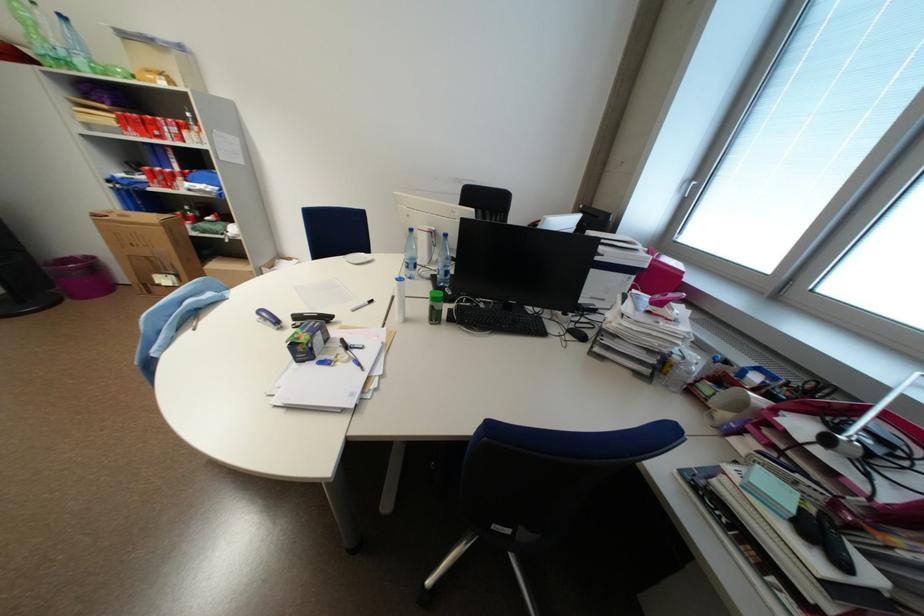
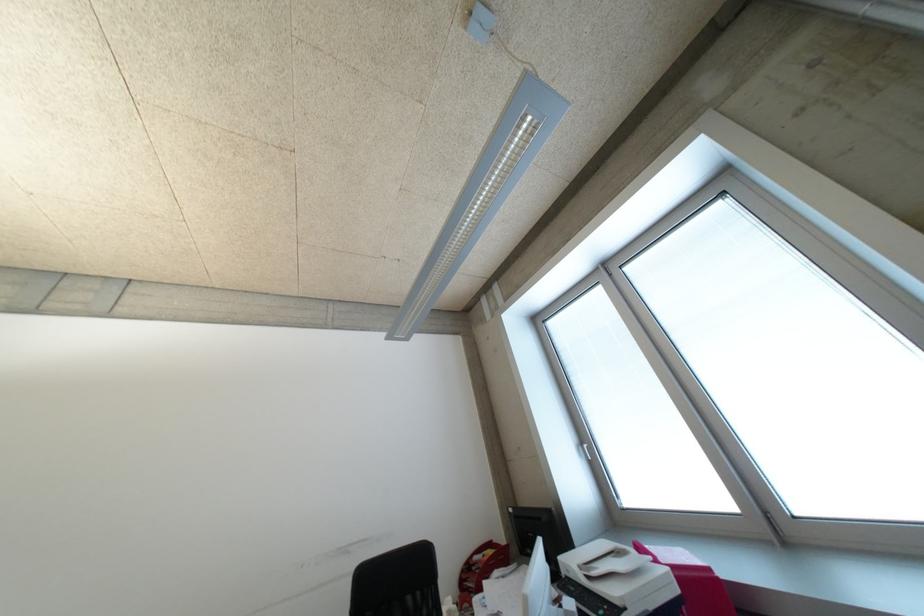
The first image is from the beginning of the video and the second image is from the end. How did the camera likely rotate when shooting the video?

The rotation direction of the camera is right-up.